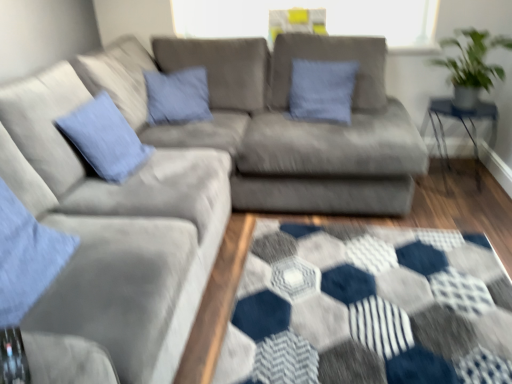
Find the location of a particular element. The width and height of the screenshot is (512, 384). blue cotton pillow at left, which appears as the 2th pillow when viewed from the back is located at coordinates point(104,138).

At what (x,y) coordinates should I click in order to perform the action: click on green leafy plant at upper right. Please return your answer as a coordinate pair (x, y). The image size is (512, 384). Looking at the image, I should click on (471, 65).

In order to face blue cotton pillow at center, which is the first pillow in right-to-left order, should I rotate leftwards or rightwards?

You should look right and rotate roughly 9.018 degrees.

Locate an element on the screen. Image resolution: width=512 pixels, height=384 pixels. clear glass table at right is located at coordinates (463, 125).

Who is shorter, green leafy plant at upper right or blue cotton pillow at center, which is the first pillow in right-to-left order?

green leafy plant at upper right.

Is green leafy plant at upper right positioned with its back to blue cotton pillow at center, the second pillow when ordered from front to back?

That's not correct — green leafy plant at upper right is not looking away from blue cotton pillow at center, the second pillow when ordered from front to back.

Is blue cotton pillow at center, which is the first pillow in right-to-left order, located within green leafy plant at upper right?

Actually, blue cotton pillow at center, which is the first pillow in right-to-left order, is outside green leafy plant at upper right.

From a real-world perspective, is green leafy plant at upper right located higher than blue cotton pillow at center, the second pillow when ordered from front to back?

Yes, from a real-world perspective, green leafy plant at upper right is on top of blue cotton pillow at center, the second pillow when ordered from front to back.

What are the coordinates of `table below the blue cotton pillow at center, positioned as the 1th pillow in back-to-front order (from the image's perspective)` in the screenshot? It's located at (463, 125).

Considering the sizes of clear glass table at right and blue cotton pillow at center, positioned as the 1th pillow in back-to-front order, in the image, is clear glass table at right taller or shorter than blue cotton pillow at center, positioned as the 1th pillow in back-to-front order,?

clear glass table at right is taller than blue cotton pillow at center, positioned as the 1th pillow in back-to-front order.

Would you say clear glass table at right contains blue cotton pillow at center, which is the first pillow in right-to-left order?

No, blue cotton pillow at center, which is the first pillow in right-to-left order, is located outside of clear glass table at right.

How distant is clear glass table at right from blue cotton pillow at center, acting as the 2th pillow starting from the left?

clear glass table at right and blue cotton pillow at center, acting as the 2th pillow starting from the left, are 27.31 inches apart from each other.

Considering the positions of objects green leafy plant at upper right and blue cotton pillow at left, the 1th pillow positioned from the left, in the image provided, who is more to the left, green leafy plant at upper right or blue cotton pillow at left, the 1th pillow positioned from the left,?

blue cotton pillow at left, the 1th pillow positioned from the left.

Looking at this image, is green leafy plant at upper right in front of blue cotton pillow at left, the 2th pillow viewed from the right?

No, green leafy plant at upper right is further to the viewer.

Is blue cotton pillow at left, the 2th pillow viewed from the right, completely or partially inside green leafy plant at upper right?

No, blue cotton pillow at left, the 2th pillow viewed from the right, is not surrounded by green leafy plant at upper right.

From a real-world perspective, which is physically below, green leafy plant at upper right or blue cotton pillow at left, the 1th pillow positioned from the left?

In real-world perspective, blue cotton pillow at left, the 1th pillow positioned from the left, is lower.

Is blue cotton pillow at left, the 1th pillow positioned from the left, looking in the opposite direction of blue cotton pillow at center, the second pillow when ordered from front to back?

No.

Is blue cotton pillow at left, which appears as the 2th pillow when viewed from the back, not near blue cotton pillow at center, which is the first pillow in right-to-left order?

Yes, blue cotton pillow at left, which appears as the 2th pillow when viewed from the back, is far from blue cotton pillow at center, which is the first pillow in right-to-left order.

Can you confirm if blue cotton pillow at left, which appears as the 2th pillow when viewed from the back, is bigger than blue cotton pillow at center, which is the first pillow in right-to-left order?

Yes.

In order to click on pillow below the blue cotton pillow at center, which is the first pillow in right-to-left order (from a real-world perspective) in this screenshot , I will do `click(104, 138)`.

Is blue cotton pillow at center, the second pillow when ordered from front to back, directly adjacent to blue cotton pillow at left, the 1th pillow positioned from the left?

No, blue cotton pillow at center, the second pillow when ordered from front to back, is not beside blue cotton pillow at left, the 1th pillow positioned from the left.

Based on the photo, from a real-world perspective, is blue cotton pillow at center, which is the first pillow in right-to-left order, on top of blue cotton pillow at left, the 1th pillow viewed from the front?

Indeed, from a real-world perspective, blue cotton pillow at center, which is the first pillow in right-to-left order, stands above blue cotton pillow at left, the 1th pillow viewed from the front.

Find the location of a particular element. pillow on the right side of blue cotton pillow at left, the 1th pillow viewed from the front is located at coordinates (322, 90).

Considering the points (337, 109) and (105, 171), which point is in front, point (337, 109) or point (105, 171)?

Point (105, 171)

In terms of height, does blue cotton pillow at center, which is the first pillow in right-to-left order, look taller or shorter compared to green leafy plant at upper right?

Clearly, blue cotton pillow at center, which is the first pillow in right-to-left order, is taller compared to green leafy plant at upper right.

Measure the distance from blue cotton pillow at center, which is the first pillow in right-to-left order, to green leafy plant at upper right.

A distance of 28.36 inches exists between blue cotton pillow at center, which is the first pillow in right-to-left order, and green leafy plant at upper right.

Does point (302, 85) come behind point (458, 68)?

Yes, it is.

Can you confirm if blue cotton pillow at center, acting as the 2th pillow starting from the left, is positioned to the left of green leafy plant at upper right?

Yes.

Is clear glass table at right surrounded by green leafy plant at upper right?

Actually, clear glass table at right is outside green leafy plant at upper right.

Would you consider green leafy plant at upper right to be distant from clear glass table at right?

green leafy plant at upper right is actually quite close to clear glass table at right.

Who is taller, green leafy plant at upper right or clear glass table at right?

Standing taller between the two is clear glass table at right.

From the image's perspective, which pillow is the 1st one below the green leafy plant at upper right? Please provide its 2D coordinates.

[(322, 90)]

The height and width of the screenshot is (384, 512). What are the coordinates of `table located on the right of blue cotton pillow at center, the second pillow when ordered from front to back` in the screenshot? It's located at (463, 125).

From the picture: Considering their positions, is blue cotton pillow at left, the 1th pillow positioned from the left, positioned closer to green leafy plant at upper right than clear glass table at right?

The object closer to green leafy plant at upper right is clear glass table at right.

Consider the image. Which object lies further to the anchor point blue cotton pillow at center, acting as the 2th pillow starting from the left, green leafy plant at upper right or blue cotton pillow at left, the 1th pillow positioned from the left?

The object further to blue cotton pillow at center, acting as the 2th pillow starting from the left, is blue cotton pillow at left, the 1th pillow positioned from the left.

Consider the image. From the image, which object appears to be farther from blue cotton pillow at left, the 1th pillow positioned from the left, green leafy plant at upper right or blue cotton pillow at center, the second pillow when ordered from front to back?

green leafy plant at upper right is further to blue cotton pillow at left, the 1th pillow positioned from the left.

When comparing their distances from clear glass table at right, does blue cotton pillow at center, acting as the 2th pillow starting from the left, or green leafy plant at upper right seem further?

blue cotton pillow at center, acting as the 2th pillow starting from the left, is further to clear glass table at right.

Which object lies nearer to the anchor point green leafy plant at upper right, clear glass table at right or blue cotton pillow at left, the 1th pillow positioned from the left?

The object closer to green leafy plant at upper right is clear glass table at right.

Looking at the image, which one is located further to green leafy plant at upper right, blue cotton pillow at center, acting as the 2th pillow starting from the left, or blue cotton pillow at left, which appears as the 2th pillow when viewed from the back?

blue cotton pillow at left, which appears as the 2th pillow when viewed from the back, is positioned further to the anchor green leafy plant at upper right.

From the image, which object appears to be nearer to blue cotton pillow at center, which is the first pillow in right-to-left order, clear glass table at right or blue cotton pillow at left, the 2th pillow viewed from the right?

clear glass table at right.

From the image, which object appears to be farther from clear glass table at right, blue cotton pillow at left, the 1th pillow positioned from the left, or green leafy plant at upper right?

Among the two, blue cotton pillow at left, the 1th pillow positioned from the left, is located further to clear glass table at right.

You are a GUI agent. You are given a task and a screenshot of the screen. Output one action in this format:
    pyautogui.click(x=<x>, y=<y>)
    Task: Click on the pillow between blue cotton pillow at left, the 1th pillow viewed from the front, and green leafy plant at upper right
    This screenshot has height=384, width=512.
    Given the screenshot: What is the action you would take?
    pyautogui.click(x=322, y=90)

You are a GUI agent. You are given a task and a screenshot of the screen. Output one action in this format:
    pyautogui.click(x=<x>, y=<y>)
    Task: Click on the pillow between blue cotton pillow at left, which appears as the 2th pillow when viewed from the back, and clear glass table at right, in the horizontal direction
    
    Given the screenshot: What is the action you would take?
    pyautogui.click(x=322, y=90)

Locate an element on the screen. plant between blue cotton pillow at center, positioned as the 1th pillow in back-to-front order, and clear glass table at right from left to right is located at coordinates (471, 65).

The image size is (512, 384). I want to click on plant between blue cotton pillow at left, the 2th pillow viewed from the right, and clear glass table at right from left to right, so click(x=471, y=65).